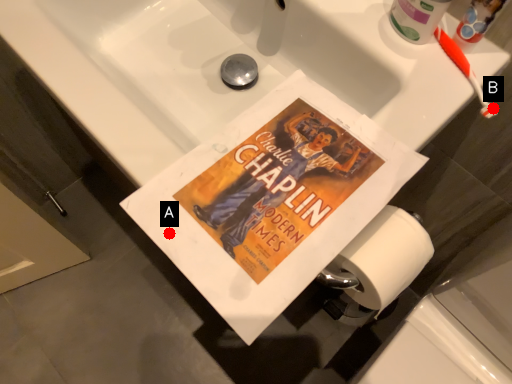
Question: Two points are circled on the image, labeled by A and B beside each circle. Which of the following is the closest to the observer?

Choices:
 (A) A is closer
 (B) B is closer

Answer: (A)